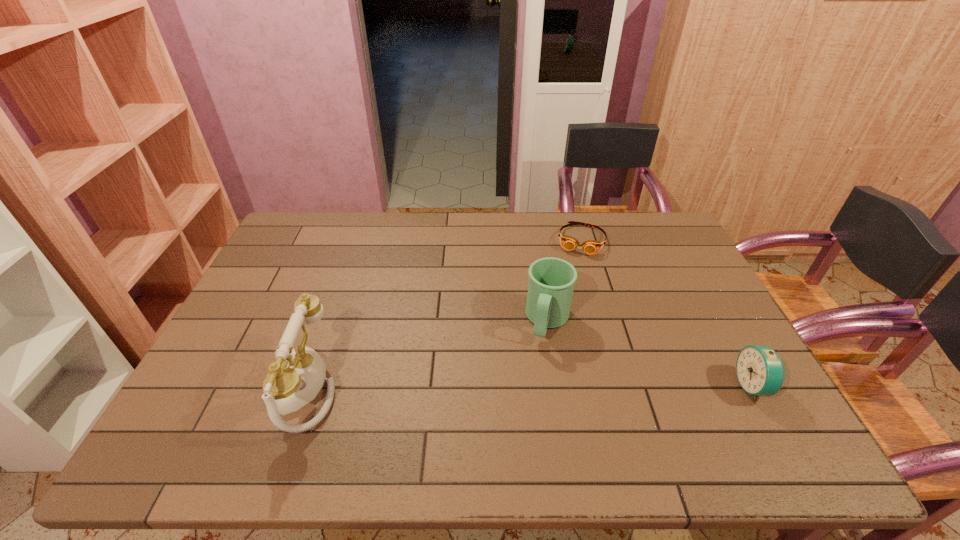
Find the location of a particular element. The width and height of the screenshot is (960, 540). free location located on the dial of the telephone is located at coordinates (238, 388).

The image size is (960, 540). Identify the location of blank space located on the front-facing side of the third tallest object. (693, 386).

Locate an element on the screen. vacant point located 0.320m on the front-facing side of the third tallest object is located at coordinates (608, 386).

Find the location of a particular element. Image resolution: width=960 pixels, height=540 pixels. free region located 0.060m on the front-facing side of the third tallest object is located at coordinates (713, 386).

The image size is (960, 540). In order to click on vacant space situated 0.130m with the lenses facing forward on the shortest object in this screenshot , I will do `click(573, 281)`.

This screenshot has width=960, height=540. What are the coordinates of `free space located 0.090m with the lenses facing forward on the shortest object` in the screenshot? It's located at [575, 274].

Image resolution: width=960 pixels, height=540 pixels. Find the location of `free location located with the lenses facing forward on the shortest object`. free location located with the lenses facing forward on the shortest object is located at coordinates [x=574, y=278].

Find the location of a particular element. free spot located on the side of the mug with the handle is located at coordinates (540, 360).

Where is `vacant region located 0.050m on the side of the mug with the handle`? This screenshot has height=540, width=960. vacant region located 0.050m on the side of the mug with the handle is located at coordinates (540, 360).

The image size is (960, 540). What are the coordinates of `vacant space located 0.100m on the side of the mug with the handle` in the screenshot? It's located at (536, 375).